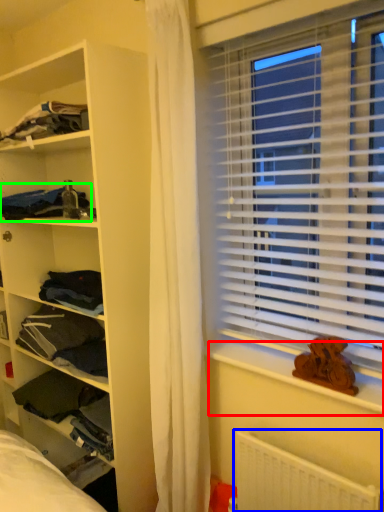
Question: Considering the real-world distances, which object is farthest from window sill (highlighted by a red box)? radiator (highlighted by a blue box) or clothing (highlighted by a green box)?

Choices:
 (A) radiator
 (B) clothing

Answer: (B)